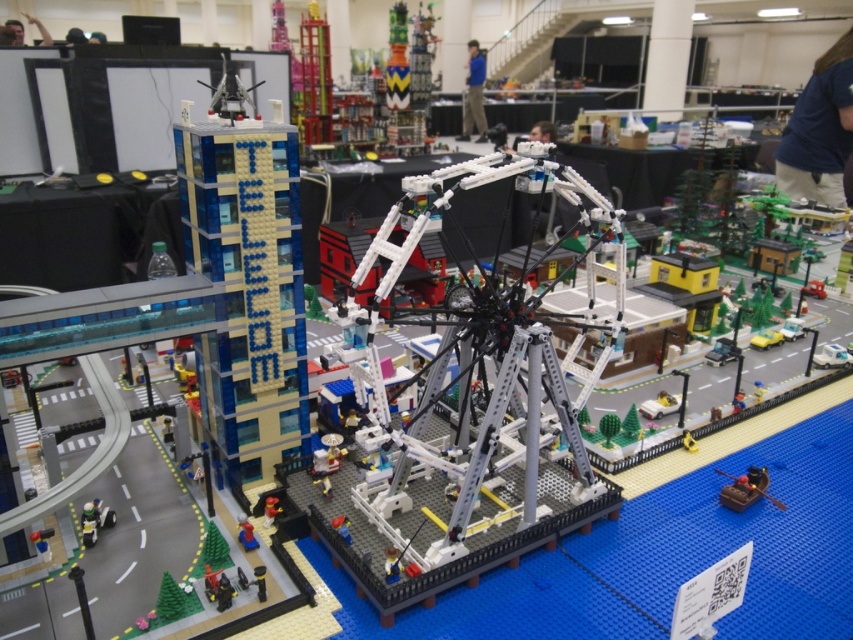
Question: Is matte brown canoe at lower right wider than white plastic car at center?

Choices:
 (A) no
 (B) yes

Answer: (B)

Question: Among these points, which one is nearest to the camera?

Choices:
 (A) (827, 353)
 (B) (91, 525)
 (C) (749, 496)

Answer: (B)

Question: Does transparent plastic ferris wheel at center appear under matte brown canoe at lower right?

Choices:
 (A) no
 (B) yes

Answer: (A)

Question: In this image, where is white plastic car at center located relative to yellow plastic car at lower right?

Choices:
 (A) right
 (B) left

Answer: (A)

Question: Which of these objects is positioned closest to the transparent plastic ferris wheel at center?

Choices:
 (A) translucent plastic minifigure at center
 (B) white plastic car at center
 (C) matte black minifigure at lower left

Answer: (A)

Question: Which of the following is the closest to the observer?

Choices:
 (A) matte black minifigure at lower left
 (B) yellow plastic car at lower right

Answer: (A)